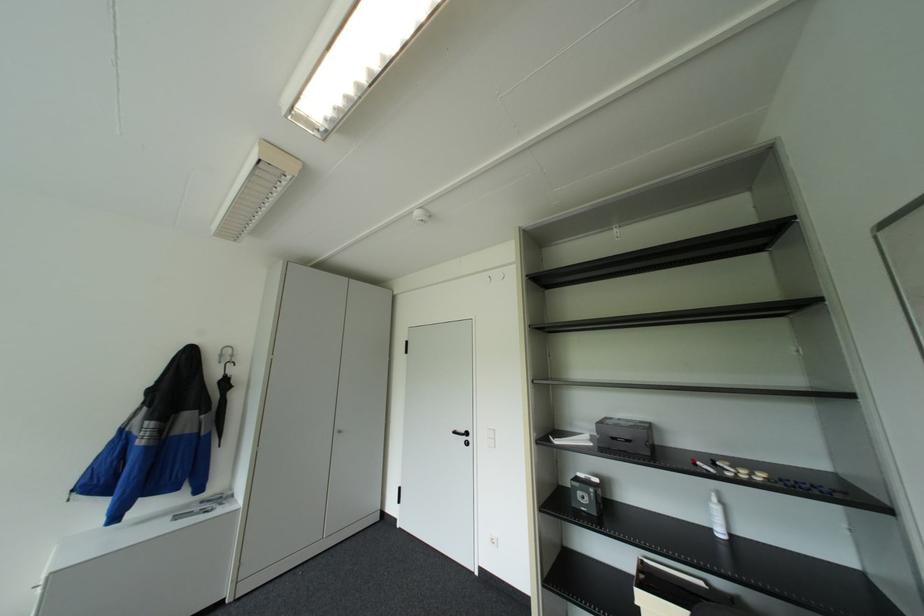
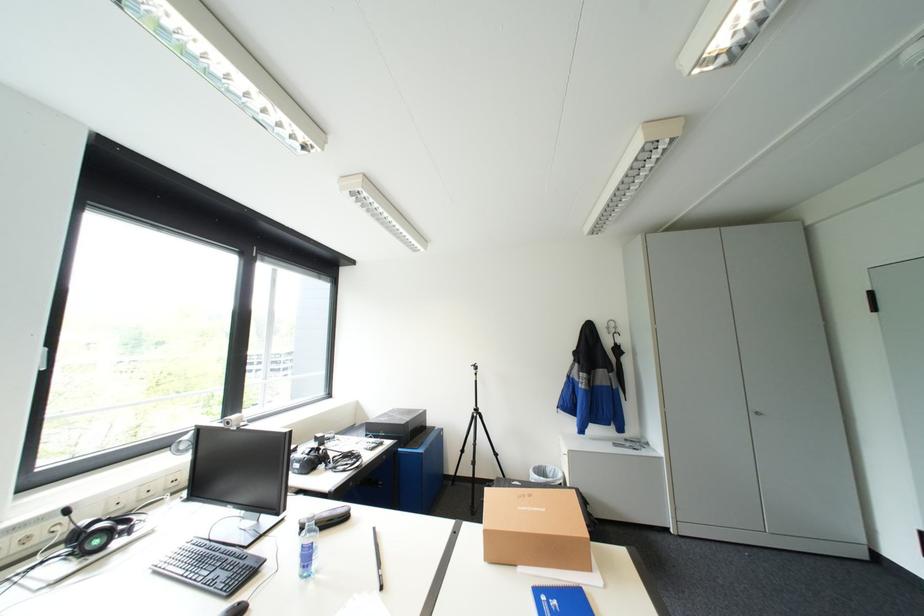
Question: How did the camera likely rotate?

Choices:
 (A) Left
 (B) Right
 (C) Up
 (D) Down

Answer: (A)